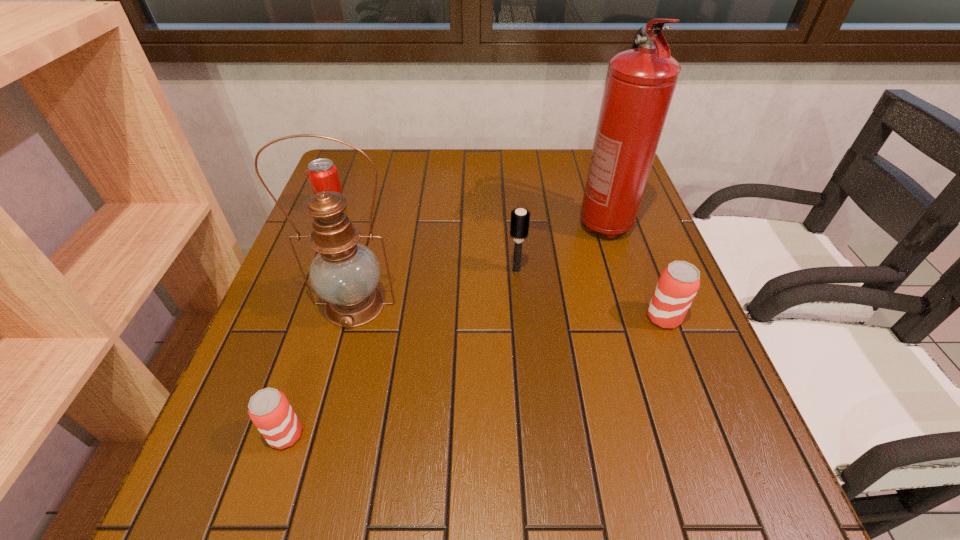
The height and width of the screenshot is (540, 960). I want to click on empty space that is in between the farther beer can and the can, so pyautogui.click(x=498, y=263).

Locate an element on the screen. The image size is (960, 540). vacant point located between the fourth shortest object and the can is located at coordinates (424, 239).

What are the coordinates of `empty space between the right beer can and the hairbrush` in the screenshot? It's located at (589, 294).

This screenshot has height=540, width=960. I want to click on vacant area that lies between the fourth shortest object and the oil lamp, so coord(436,287).

Image resolution: width=960 pixels, height=540 pixels. I want to click on free space that is in between the left beer can and the can, so click(309, 321).

Image resolution: width=960 pixels, height=540 pixels. In order to click on free space between the fourth object from left to right and the fire extinguisher in this screenshot , I will do `click(561, 247)`.

Where is `vacant area between the fire extinguisher and the fourth nearest object`? vacant area between the fire extinguisher and the fourth nearest object is located at coordinates (561, 247).

Where is `the second closest object relative to the hairbrush`? The height and width of the screenshot is (540, 960). the second closest object relative to the hairbrush is located at coordinates (345, 273).

This screenshot has width=960, height=540. Find the location of `object that is the closest to the taller beer can`. object that is the closest to the taller beer can is located at coordinates (640, 83).

The image size is (960, 540). I want to click on vacant space that satisfies the following two spatial constraints: 1. on the front side of the can; 2. on the right side of the taller beer can, so click(x=290, y=318).